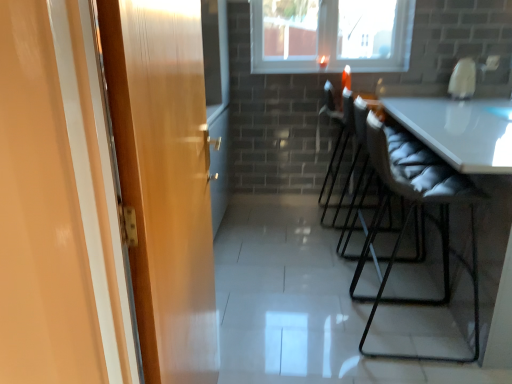
Find the location of a particular element. free space to the left of matte gray chair at center right, the second chair when ordered from front to back is located at coordinates (308, 240).